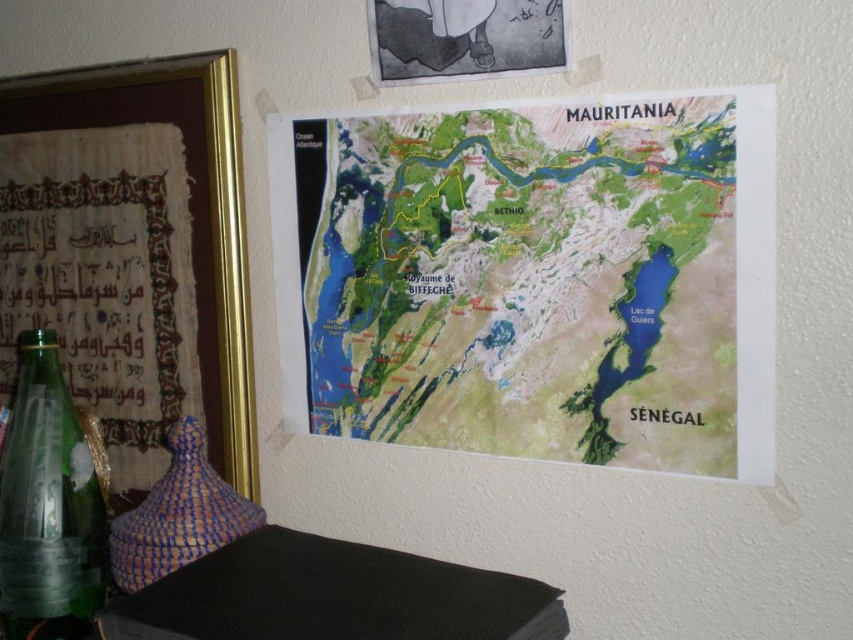
Which is more to the right, green paper map at upper center or gold-framed picture at left?

From the viewer's perspective, green paper map at upper center appears more on the right side.

This screenshot has height=640, width=853. What are the coordinates of `green paper map at upper center` in the screenshot? It's located at 521,282.

At what (x,y) coordinates should I click in order to perform the action: click on green paper map at upper center. Please return your answer as a coordinate pair (x, y). Looking at the image, I should click on (521, 282).

Is black matte book at lower left bigger than transparent glass bottle at lower left?

Yes, black matte book at lower left is bigger than transparent glass bottle at lower left.

Identify the location of black matte book at lower left. Image resolution: width=853 pixels, height=640 pixels. (332, 596).

Is gold-framed picture at left further to camera compared to transparent glass bottle at lower left?

Yes, gold-framed picture at left is further from the viewer.

Is point (113, 328) positioned behind point (39, 564)?

Yes, it is behind point (39, 564).

Measure the distance between gold-framed picture at left and camera.

A distance of 34.13 inches exists between gold-framed picture at left and camera.

The height and width of the screenshot is (640, 853). Identify the location of gold-framed picture at left. (132, 252).